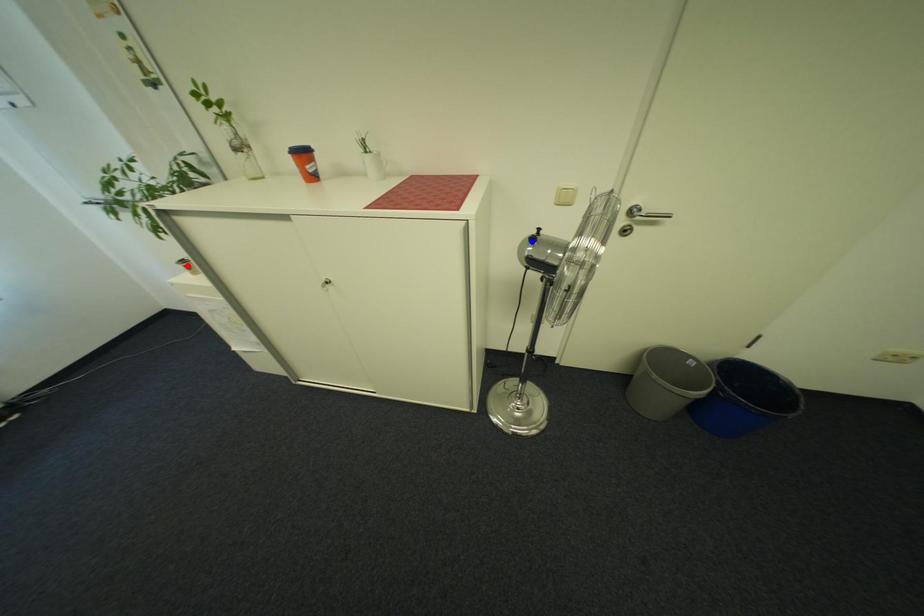
Question: Two points are marked on the image. Which point is closer to the camera?

Choices:
 (A) Blue point is closer.
 (B) Red point is closer.

Answer: (A)